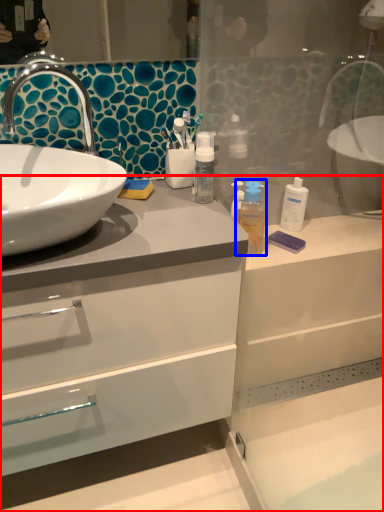
Question: Which point is further to the camera, bathroom cabinet (highlighted by a red box) or mouthwash (highlighted by a blue box)?

Choices:
 (A) bathroom cabinet
 (B) mouthwash

Answer: (B)